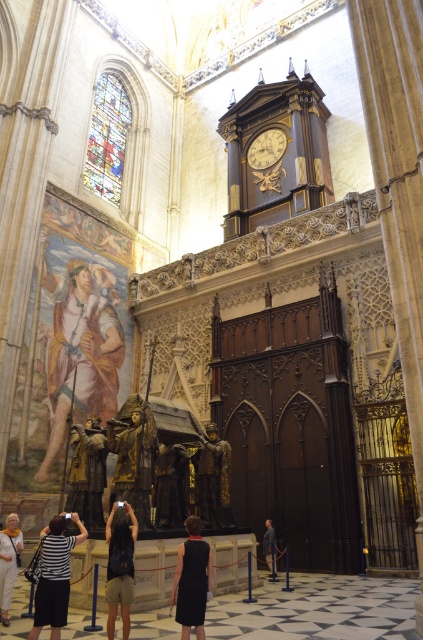
You are a photographer standing in the cathedral and want to take a photo of both the black satin dress at center and the white cotton dress at lower left. Can you fit both dresses in the frame of your camera if your camera has a maximum field of view of 10 meters?

The black satin dress at center and white cotton dress at lower left are 11.51 meters apart from each other, which exceeds the camera field of view of 10 meters. Therefore, you cannot fit both dresses in the frame.

You are a photographer planning to take a photo of the black satin dress at center and the polished bronze statue at center in the cathedral. To ensure both are visible in the frame, which object should you position closer to the camera?

The black satin dress at center is smaller than the polished bronze statue at center, so you should position the black satin dress at center closer to the camera to ensure both are visible in the frame.